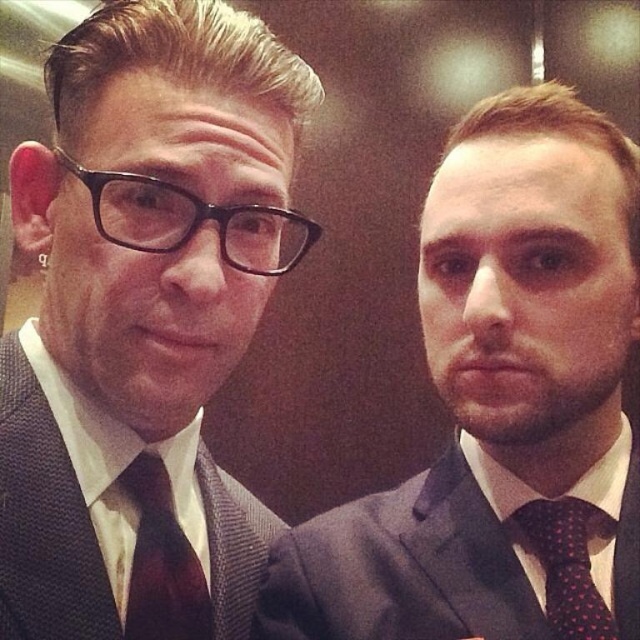
Question: Does matte black suit at right appear on the right side of polka dot silk tie at right?

Choices:
 (A) yes
 (B) no

Answer: (B)

Question: Where is matte black suit at center located in relation to dark brown textured tie at left in the image?

Choices:
 (A) above
 (B) below

Answer: (A)

Question: Does dark brown textured tie at left appear on the left side of polka dot silk tie at right?

Choices:
 (A) no
 (B) yes

Answer: (B)

Question: Considering the real-world distances, which object is closest to the polka dot silk tie at right?

Choices:
 (A) matte black suit at right
 (B) dark gray textured suit at right
 (C) dark brown textured suit at left
 (D) dark brown textured tie at left

Answer: (B)

Question: Which point is closer to the camera?

Choices:
 (A) (248, 164)
 (B) (560, 508)
 (C) (419, 600)
 (D) (550, 490)

Answer: (A)

Question: Considering the real-world distances, which object is farthest from the polka dot silk tie at right?

Choices:
 (A) dark gray textured suit at right
 (B) dark brown textured tie at left
 (C) matte black suit at right

Answer: (B)